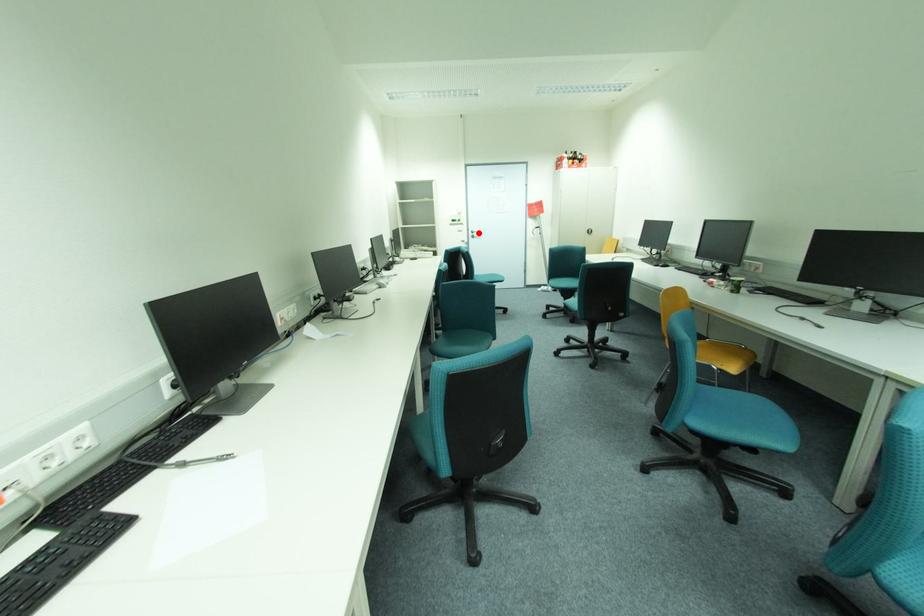
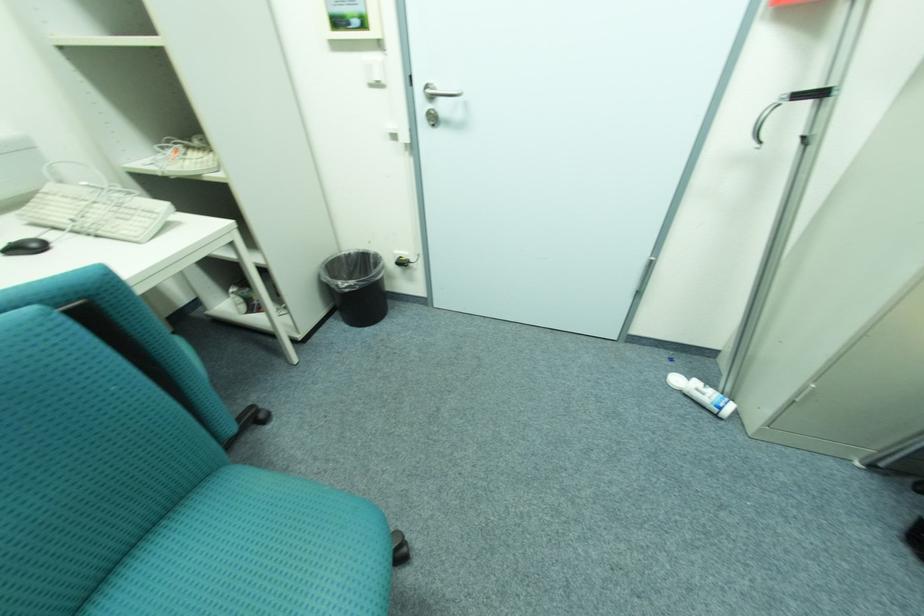
In the second image, find the point that corresponds to the highlighted location in the first image.

(439, 97)